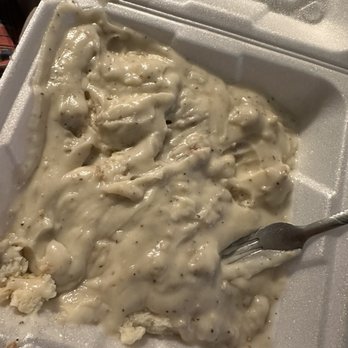
The width and height of the screenshot is (348, 348). I want to click on table, so click(x=9, y=28).